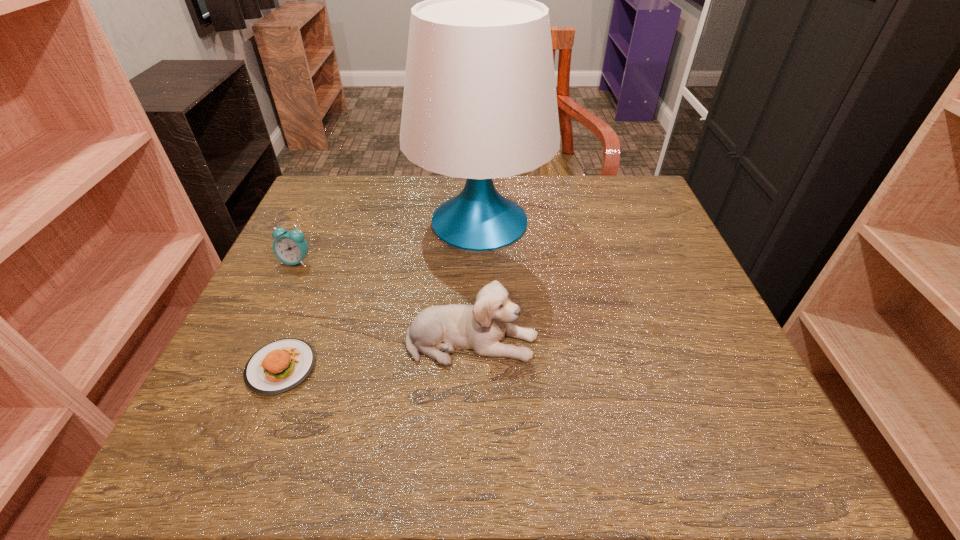
Where is `food located in the left edge section of the desktop`? The height and width of the screenshot is (540, 960). food located in the left edge section of the desktop is located at coordinates (281, 365).

You are a GUI agent. You are given a task and a screenshot of the screen. Output one action in this format:
    pyautogui.click(x=<x>, y=<y>)
    Task: Click on the vacant point at the far edge
    
    Given the screenshot: What is the action you would take?
    pyautogui.click(x=418, y=209)

Image resolution: width=960 pixels, height=540 pixels. I want to click on vacant region at the near edge of the desktop, so click(286, 467).

I want to click on vacant space at the left edge of the desktop, so click(x=303, y=277).

What are the coordinates of `vacant position at the right edge of the desktop` in the screenshot? It's located at (651, 374).

At what (x,y) coordinates should I click in order to perform the action: click on free region at the far left corner of the desktop. Please return your answer as a coordinate pair (x, y). The image size is (960, 540). Looking at the image, I should click on click(367, 192).

You are a GUI agent. You are given a task and a screenshot of the screen. Output one action in this format:
    pyautogui.click(x=<x>, y=<y>)
    Task: Click on the vacant region at the far right corner of the desktop
    This screenshot has height=540, width=960.
    Given the screenshot: What is the action you would take?
    pyautogui.click(x=612, y=191)

The image size is (960, 540). Find the location of `vacant space at the near right corner of the desktop`. vacant space at the near right corner of the desktop is located at coordinates (728, 415).

Where is `unoccupied area between the third shortest object and the alarm clock`? unoccupied area between the third shortest object and the alarm clock is located at coordinates (384, 301).

Where is `free space between the food and the third shortest object`? free space between the food and the third shortest object is located at coordinates (376, 354).